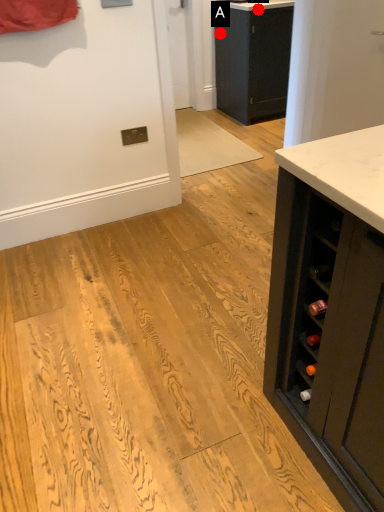
Question: Two points are circled on the image, labeled by A and B beside each circle. Which point is farther to the camera?

Choices:
 (A) A is further
 (B) B is further

Answer: (A)